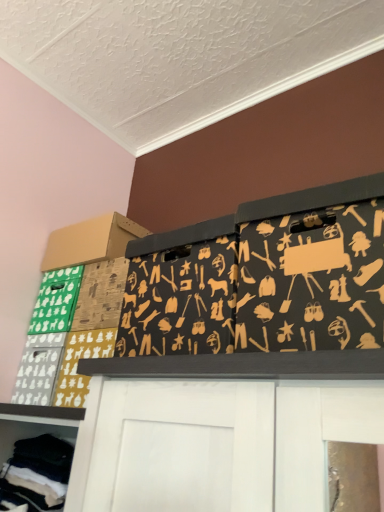
At what (x,y) coordinates should I click in order to perform the action: click on black fabric with tool patterns at upper center. Please return your answer as a coordinate pair (x, y). The image size is (384, 512). Looking at the image, I should click on (262, 287).

What do you see at coordinates (262, 287) in the screenshot? I see `black fabric with tool patterns at upper center` at bounding box center [262, 287].

Image resolution: width=384 pixels, height=512 pixels. In order to click on black fabric with tool patterns at upper center in this screenshot , I will do `click(262, 287)`.